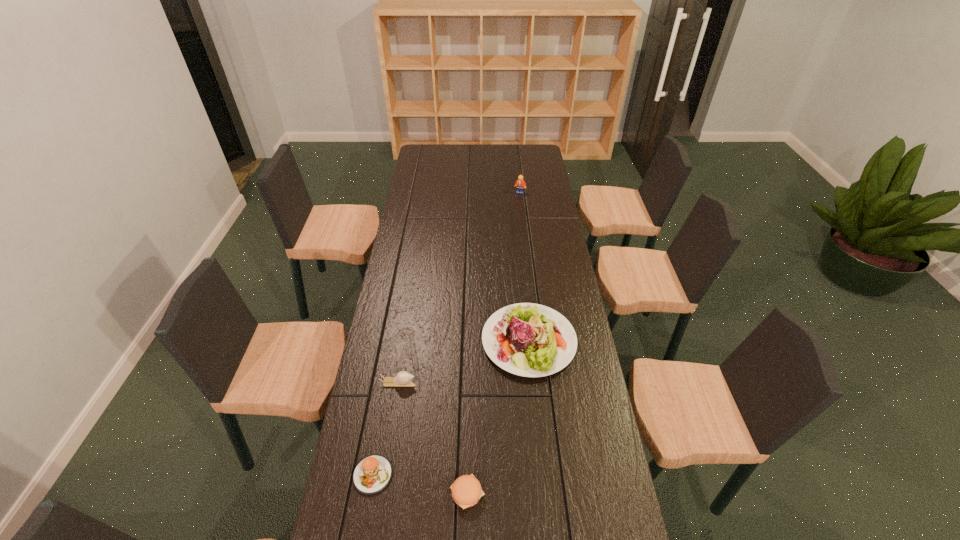
Locate an element on the screen. free space that satisfies the following two spatial constraints: 1. on the front side of the right patty; 2. on the right side of the left patty is located at coordinates (370, 493).

The height and width of the screenshot is (540, 960). I want to click on vacant space that satisfies the following two spatial constraints: 1. on the shell of the escargot; 2. on the back side of the right patty, so click(x=381, y=493).

Locate an element on the screen. vacant position in the image that satisfies the following two spatial constraints: 1. on the shell of the escargot; 2. on the right side of the right patty is located at coordinates (381, 493).

Identify the location of free space in the image that satisfies the following two spatial constraints: 1. on the shell of the right patty; 2. on the left side of the third tallest object. The height and width of the screenshot is (540, 960). (381, 493).